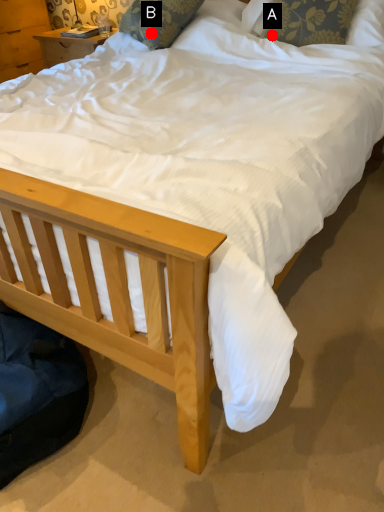
Question: Two points are circled on the image, labeled by A and B beside each circle. Among these points, which one is nearest to the camera?

Choices:
 (A) A is closer
 (B) B is closer

Answer: (A)